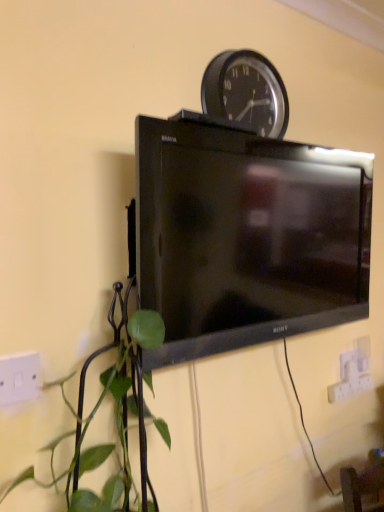
Describe the element at coordinates (246, 236) in the screenshot. Image resolution: width=384 pixels, height=512 pixels. I see `black glossy tv at center` at that location.

What do you see at coordinates (246, 92) in the screenshot? The width and height of the screenshot is (384, 512). I see `black plastic wall clock at upper center` at bounding box center [246, 92].

Measure the distance between point (236,52) and camera.

Point (236,52) is 3.75 feet from camera.

At what (x,y) coordinates should I click in order to perform the action: click on white plastic electric outlet at lower right, which is counted as the 1th electric outlet, starting from the back. Please return your answer as a coordinate pair (x, y). Looking at the image, I should click on (352, 372).

From a real-world perspective, is black plastic wall clock at upper center physically located above or below white plastic electric outlet at lower left, acting as the first electric outlet starting from the top?

In terms of real-world spatial position, black plastic wall clock at upper center is above white plastic electric outlet at lower left, acting as the first electric outlet starting from the top.

Considering the positions of objects black plastic wall clock at upper center and white plastic electric outlet at lower left, marked as the second electric outlet in a bottom-to-top arrangement, in the image provided, who is in front, black plastic wall clock at upper center or white plastic electric outlet at lower left, marked as the second electric outlet in a bottom-to-top arrangement,?

Positioned in front is white plastic electric outlet at lower left, marked as the second electric outlet in a bottom-to-top arrangement.

This screenshot has height=512, width=384. Find the location of `wall clock above the white plastic electric outlet at lower left, acting as the first electric outlet starting from the top (from the image's perspective)`. wall clock above the white plastic electric outlet at lower left, acting as the first electric outlet starting from the top (from the image's perspective) is located at coordinates (246, 92).

Could you tell me if black plastic wall clock at upper center is turned towards white plastic electric outlet at lower left, the 1th electric outlet positioned from the left?

No, black plastic wall clock at upper center is not aimed at white plastic electric outlet at lower left, the 1th electric outlet positioned from the left.

Looking at this image, considering the relative positions of white plastic electric outlet at lower right, arranged as the 2th electric outlet when viewed from the front, and black glossy tv at center in the image provided, is white plastic electric outlet at lower right, arranged as the 2th electric outlet when viewed from the front, to the right of black glossy tv at center from the viewer's perspective?

Indeed, white plastic electric outlet at lower right, arranged as the 2th electric outlet when viewed from the front, is positioned on the right side of black glossy tv at center.

Considering the sizes of objects white plastic electric outlet at lower right, which ranks as the first electric outlet in bottom-to-top order, and black glossy tv at center in the image provided, who is wider, white plastic electric outlet at lower right, which ranks as the first electric outlet in bottom-to-top order, or black glossy tv at center?

black glossy tv at center is wider.

From a real-world perspective, is white plastic electric outlet at lower right, which is counted as the second electric outlet, starting from the top, positioned under black glossy tv at center based on gravity?

Yes.

Are white plastic electric outlet at lower right, the 1th electric outlet from the right, and black glossy tv at center located far from each other?

Actually, white plastic electric outlet at lower right, the 1th electric outlet from the right, and black glossy tv at center are a little close together.

Based on the photo, which of these two, black glossy tv at center or black plastic wall clock at upper center, is bigger?

black glossy tv at center.

From the image's perspective, is black glossy tv at center over black plastic wall clock at upper center?

No.

Between black glossy tv at center and black plastic wall clock at upper center, which one has more height?

Standing taller between the two is black glossy tv at center.

Can you confirm if black glossy tv at center is shorter than white plastic electric outlet at lower right, which is counted as the 1th electric outlet, starting from the back?

Incorrect, the height of black glossy tv at center does not fall short of that of white plastic electric outlet at lower right, which is counted as the 1th electric outlet, starting from the back.

Does black glossy tv at center appear on the left side of white plastic electric outlet at lower right, which is counted as the second electric outlet, starting from the top?

Yes, black glossy tv at center is to the left of white plastic electric outlet at lower right, which is counted as the second electric outlet, starting from the top.

What's the angular difference between black glossy tv at center and white plastic electric outlet at lower right, which ranks as the first electric outlet in bottom-to-top order,'s facing directions?

The angle between the facing direction of black glossy tv at center and the facing direction of white plastic electric outlet at lower right, which ranks as the first electric outlet in bottom-to-top order, is 3.23 degrees.

Between black glossy tv at center and white plastic electric outlet at lower right, the 1th electric outlet from the right, which one is positioned behind?

white plastic electric outlet at lower right, the 1th electric outlet from the right, is more distant.

From the image's perspective, is white plastic electric outlet at lower right, the 1th electric outlet from the right, located beneath white plastic electric outlet at lower left, marked as the second electric outlet in a bottom-to-top arrangement?

Correct, white plastic electric outlet at lower right, the 1th electric outlet from the right, appears lower than white plastic electric outlet at lower left, marked as the second electric outlet in a bottom-to-top arrangement, in the image.

Between point (354, 381) and point (3, 376), which one is positioned in front?

The point (3, 376) is closer to the camera.

Looking at this image, how different are the orientations of white plastic electric outlet at lower right, arranged as the 2th electric outlet when viewed from the front, and white plastic electric outlet at lower left, marked as the 2th electric outlet in a right-to-left arrangement, in degrees?

white plastic electric outlet at lower right, arranged as the 2th electric outlet when viewed from the front, and white plastic electric outlet at lower left, marked as the 2th electric outlet in a right-to-left arrangement, are facing 1.29 degrees away from each other.

From a real-world perspective, who is located higher, white plastic electric outlet at lower left, acting as the first electric outlet starting from the top, or white plastic electric outlet at lower right, which ranks as the first electric outlet in bottom-to-top order?

From a 3D spatial view, white plastic electric outlet at lower left, acting as the first electric outlet starting from the top, is above.

In the image, is white plastic electric outlet at lower left, the second electric outlet positioned from the back, positioned in front of or behind white plastic electric outlet at lower right, arranged as the 2th electric outlet when viewed from the front?

Visually, white plastic electric outlet at lower left, the second electric outlet positioned from the back, is located in front of white plastic electric outlet at lower right, arranged as the 2th electric outlet when viewed from the front.

Considering the positions of objects white plastic electric outlet at lower left, the 1th electric outlet positioned from the left, and white plastic electric outlet at lower right, arranged as the 2th electric outlet when viewed from the front, in the image provided, who is more to the right, white plastic electric outlet at lower left, the 1th electric outlet positioned from the left, or white plastic electric outlet at lower right, arranged as the 2th electric outlet when viewed from the front,?

white plastic electric outlet at lower right, arranged as the 2th electric outlet when viewed from the front, is more to the right.

Based on their positions, is white plastic electric outlet at lower left, marked as the second electric outlet in a bottom-to-top arrangement, located to the left or right of black glossy tv at center?

white plastic electric outlet at lower left, marked as the second electric outlet in a bottom-to-top arrangement, is to the left of black glossy tv at center.

Does white plastic electric outlet at lower left, the 1th electric outlet positioned from the front, touch black glossy tv at center?

No, white plastic electric outlet at lower left, the 1th electric outlet positioned from the front, is not in contact with black glossy tv at center.

Could you tell me if white plastic electric outlet at lower left, acting as the first electric outlet starting from the top, is turned towards black glossy tv at center?

No, white plastic electric outlet at lower left, acting as the first electric outlet starting from the top, is not facing towards black glossy tv at center.

From the image's perspective, is white plastic electric outlet at lower left, marked as the 2th electric outlet in a right-to-left arrangement, under black glossy tv at center?

Indeed, from the image's perspective, white plastic electric outlet at lower left, marked as the 2th electric outlet in a right-to-left arrangement, is shown beneath black glossy tv at center.

From a real-world perspective, which electric outlet is the 1st one underneath the black plastic wall clock at upper center? Please provide its 2D coordinates.

[(19, 378)]

Locate an element on the screen. The height and width of the screenshot is (512, 384). television above the white plastic electric outlet at lower right, arranged as the 2th electric outlet when viewed from the front (from the image's perspective) is located at coordinates (246, 236).

Based on the photo, estimate the real-world distances between objects in this image. Which object is closer to white plastic electric outlet at lower right, which ranks as the first electric outlet in bottom-to-top order, white plastic electric outlet at lower left, acting as the first electric outlet starting from the top, or black glossy tv at center?

The object closer to white plastic electric outlet at lower right, which ranks as the first electric outlet in bottom-to-top order, is black glossy tv at center.

Estimate the real-world distances between objects in this image. Which object is further from black plastic wall clock at upper center, white plastic electric outlet at lower right, which ranks as the first electric outlet in bottom-to-top order, or black glossy tv at center?

white plastic electric outlet at lower right, which ranks as the first electric outlet in bottom-to-top order, is positioned further to the anchor black plastic wall clock at upper center.

From the image, which object appears to be nearer to black glossy tv at center, white plastic electric outlet at lower left, the second electric outlet positioned from the back, or black plastic wall clock at upper center?

The object closer to black glossy tv at center is black plastic wall clock at upper center.

Estimate the real-world distances between objects in this image. Which object is further from white plastic electric outlet at lower right, which ranks as the first electric outlet in bottom-to-top order, black plastic wall clock at upper center or white plastic electric outlet at lower left, the 1th electric outlet positioned from the front?

white plastic electric outlet at lower left, the 1th electric outlet positioned from the front, is positioned further to the anchor white plastic electric outlet at lower right, which ranks as the first electric outlet in bottom-to-top order.

Based on their spatial positions, is black glossy tv at center or white plastic electric outlet at lower left, the 1th electric outlet positioned from the front, further from white plastic electric outlet at lower right, arranged as the 2th electric outlet when viewed from the front?

Based on the image, white plastic electric outlet at lower left, the 1th electric outlet positioned from the front, appears to be further to white plastic electric outlet at lower right, arranged as the 2th electric outlet when viewed from the front.

Estimate the real-world distances between objects in this image. Which object is closer to white plastic electric outlet at lower right, the 1th electric outlet from the right, white plastic electric outlet at lower left, acting as the first electric outlet starting from the top, or black plastic wall clock at upper center?

black plastic wall clock at upper center is positioned closer to the anchor white plastic electric outlet at lower right, the 1th electric outlet from the right.

Looking at the image, which one is located closer to black plastic wall clock at upper center, white plastic electric outlet at lower left, the 1th electric outlet positioned from the left, or white plastic electric outlet at lower right, arranged as the 2th electric outlet when viewed from the front?

Among the two, white plastic electric outlet at lower left, the 1th electric outlet positioned from the left, is located nearer to black plastic wall clock at upper center.

Looking at the image, which one is located further to black plastic wall clock at upper center, white plastic electric outlet at lower right, which is counted as the second electric outlet, starting from the top, or white plastic electric outlet at lower left, the second electric outlet positioned from the back?

white plastic electric outlet at lower right, which is counted as the second electric outlet, starting from the top, is further to black plastic wall clock at upper center.

At what (x,y) coordinates should I click in order to perform the action: click on television between black plastic wall clock at upper center and white plastic electric outlet at lower right, which is counted as the 1th electric outlet, starting from the back, in the up-down direction. Please return your answer as a coordinate pair (x, y). Looking at the image, I should click on (246, 236).

Where is `television between black plastic wall clock at upper center and white plastic electric outlet at lower left, acting as the first electric outlet starting from the top, in the up-down direction`? This screenshot has height=512, width=384. television between black plastic wall clock at upper center and white plastic electric outlet at lower left, acting as the first electric outlet starting from the top, in the up-down direction is located at coordinates (246, 236).

Locate an element on the screen. electric outlet between black plastic wall clock at upper center and white plastic electric outlet at lower right, which is counted as the second electric outlet, starting from the top, vertically is located at coordinates (19, 378).

The height and width of the screenshot is (512, 384). In order to click on television situated between white plastic electric outlet at lower left, the second electric outlet positioned from the back, and white plastic electric outlet at lower right, arranged as the 2th electric outlet when viewed from the front, from left to right in this screenshot , I will do `click(246, 236)`.